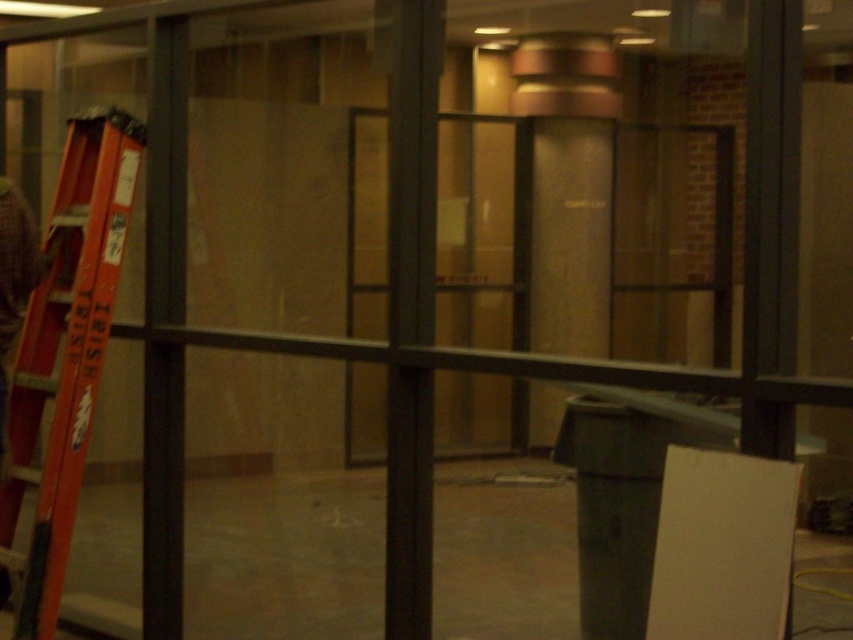
Can you confirm if orange metallic ladder at left is shorter than black metal pole at center?

Indeed, orange metallic ladder at left has a lesser height compared to black metal pole at center.

Which is more to the left, orange metallic ladder at left or black metal pole at center?

Positioned to the left is orange metallic ladder at left.

Between point (62, 504) and point (422, 83), which one is positioned in front?

Point (422, 83) is in front.

The image size is (853, 640). Find the location of `orange metallic ladder at left`. orange metallic ladder at left is located at coordinates (67, 349).